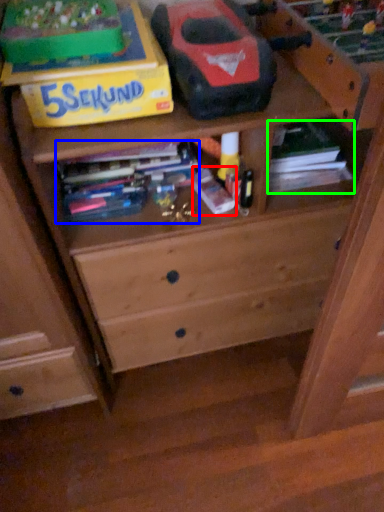
Question: Which is farther away from book (highlighted by a red box)? book (highlighted by a blue box) or book (highlighted by a green box)?

Choices:
 (A) book
 (B) book

Answer: (B)